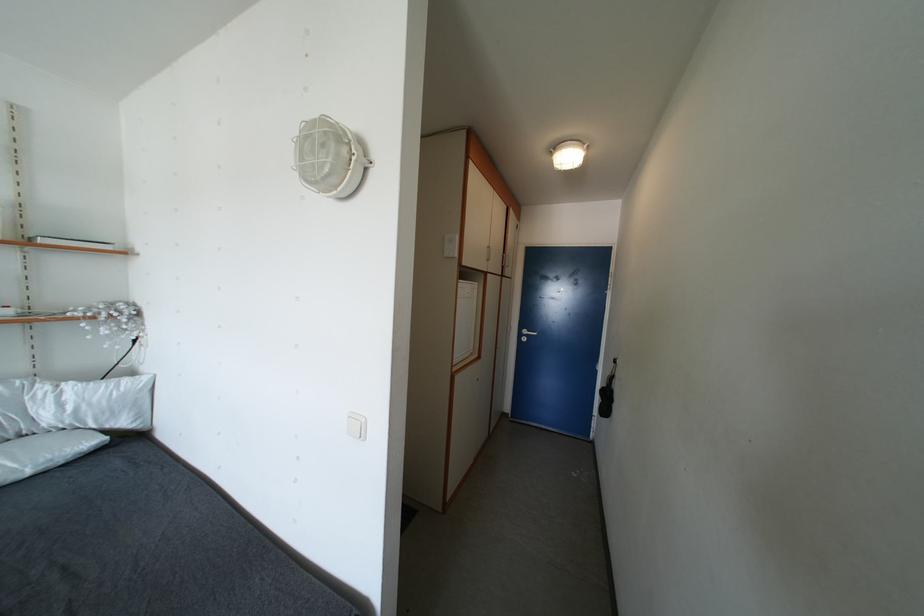
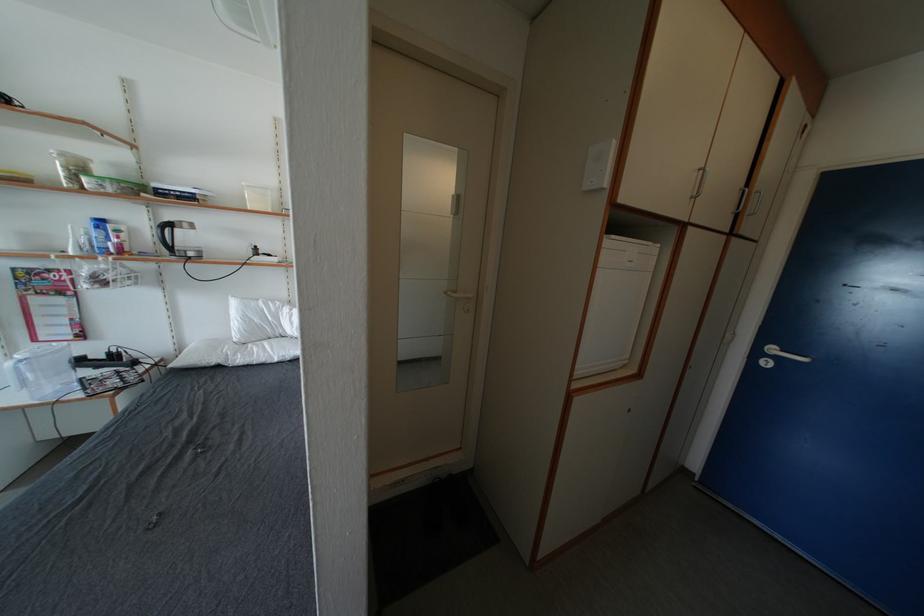
In the second image, find the point that corresponds to the point at 531,336 in the first image.

(779, 354)